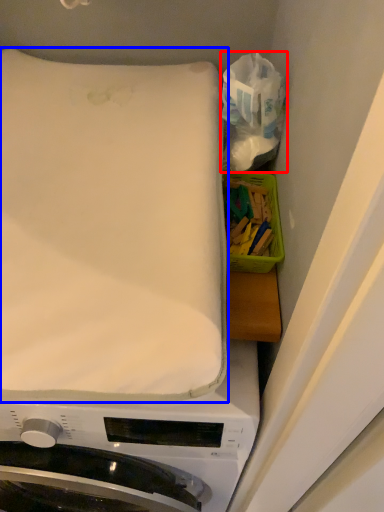
Question: Which of the following is the farthest to the observer, tissue (highlighted by a red box) or mattress (highlighted by a blue box)?

Choices:
 (A) tissue
 (B) mattress

Answer: (A)